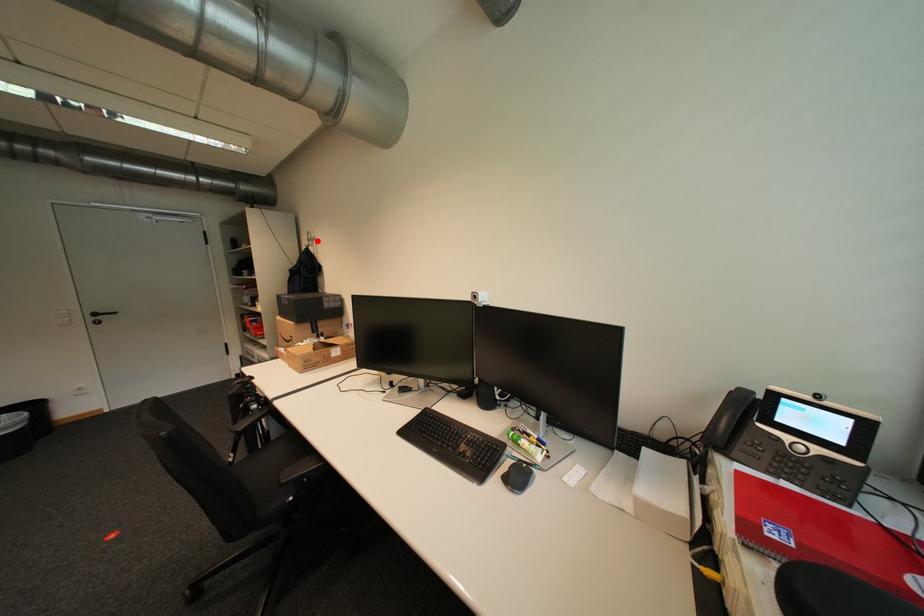
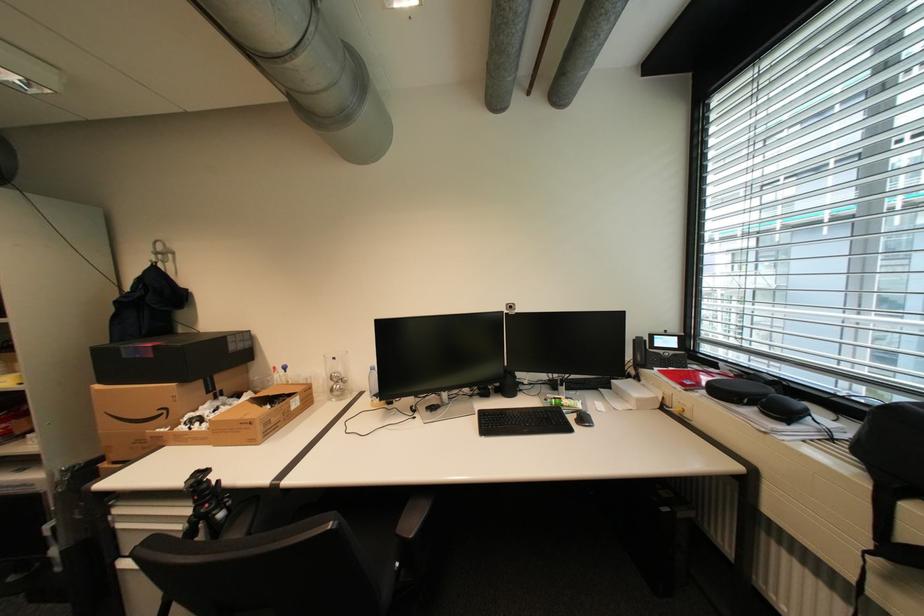
In the second image, find the point that corresponds to the highlighted location in the first image.

(165, 254)